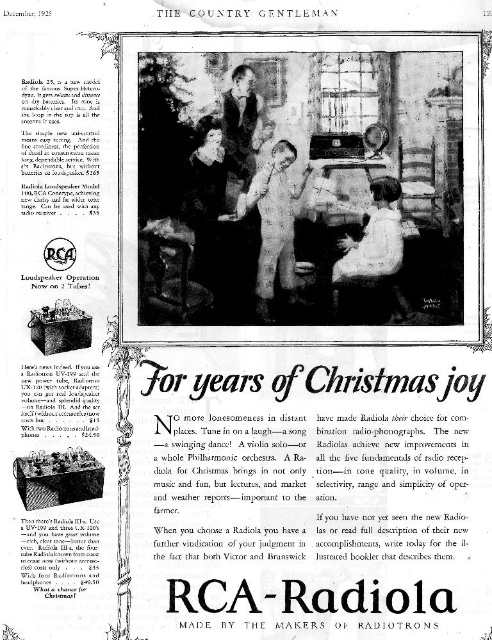
Question: Considering the relative positions of white cotton shirt at center and smooth leather jacket at center in the image provided, where is white cotton shirt at center located with respect to smooth leather jacket at center?

Choices:
 (A) left
 (B) right

Answer: (B)

Question: Which object is closer to the camera taking this photo?

Choices:
 (A) smooth leather jacket at center
 (B) white cotton overalls at center
 (C) white cotton shirt at center

Answer: (A)

Question: Does white cotton shirt at center appear on the right side of white cotton overalls at center?

Choices:
 (A) no
 (B) yes

Answer: (B)

Question: Is white cotton shirt at center above smooth leather jacket at center?

Choices:
 (A) no
 (B) yes

Answer: (A)

Question: Which is nearer to the white cotton shirt at center?

Choices:
 (A) smooth leather jacket at center
 (B) white cotton overalls at center

Answer: (B)

Question: Which of these objects is positioned farthest from the white cotton overalls at center?

Choices:
 (A) smooth leather jacket at center
 (B) white cotton shirt at center

Answer: (B)